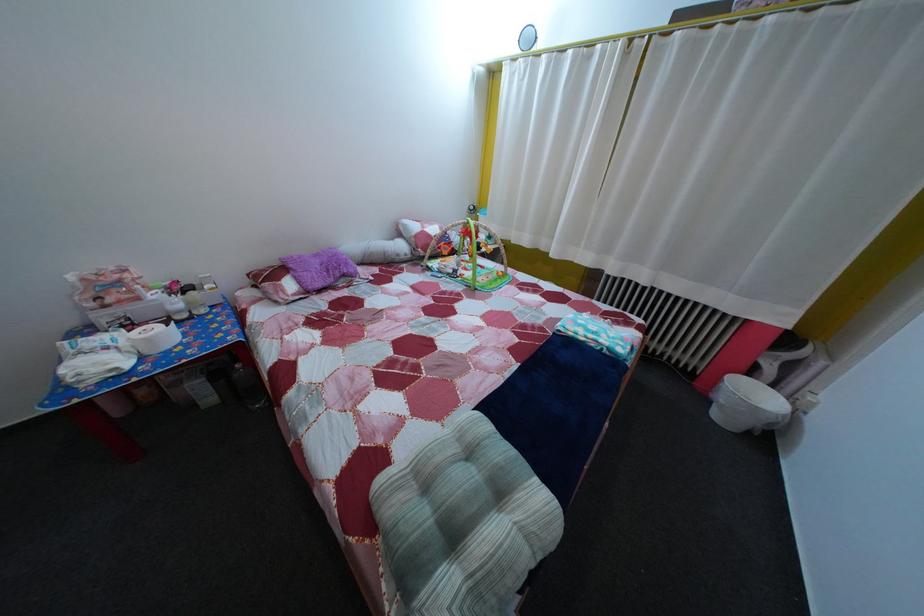
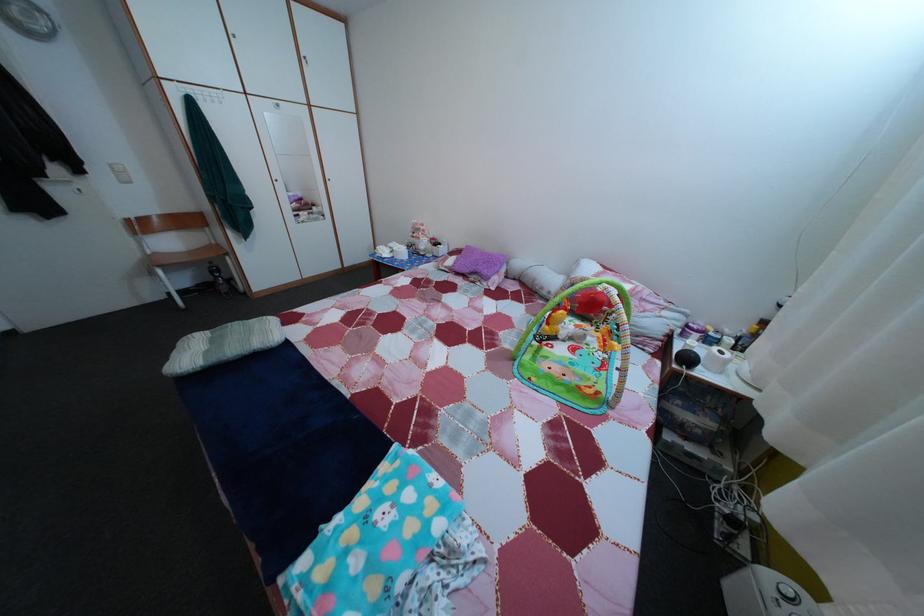
The point at (412,265) is marked in the first image. Where is the corresponding point in the second image?

(553, 301)